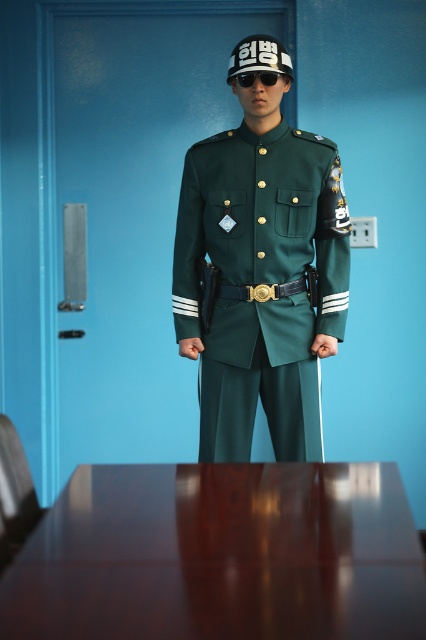
You are organizing a formal event and need to place a 1.2 meter wide banner between the glossy wood table at lower center and the green matte uniform at center. Can the banner fit between them based on their sizes?

The glossy wood table at lower center is smaller than the green matte uniform at center. Since the banner is 1.2 meters wide, it depends on the actual dimensions of the space between them. However, since the table is smaller, there might not be enough space. Without exact measurements, it is uncertain if the banner will fit.

You are a photographer trying to capture a closeup shot of the person in the military uniform. You notice two points of interest marked at coordinates point (247, 333) and point (270, 74). Which point is closer to your camera lens?

Point (247, 333) is further to the viewer than point (270, 74), so the point closer to the camera lens is point (270, 74).

You are an interior designer planning to place a decorative item on the glossy wood table at lower center. Considering the height of the black plastic sunglasses at center, will the table provide enough vertical space for the item to stand upright without touching the sunglasses?

The glossy wood table at lower center is taller than the black plastic sunglasses at center, so there is sufficient vertical space for a decorative item to stand upright without touching the sunglasses.